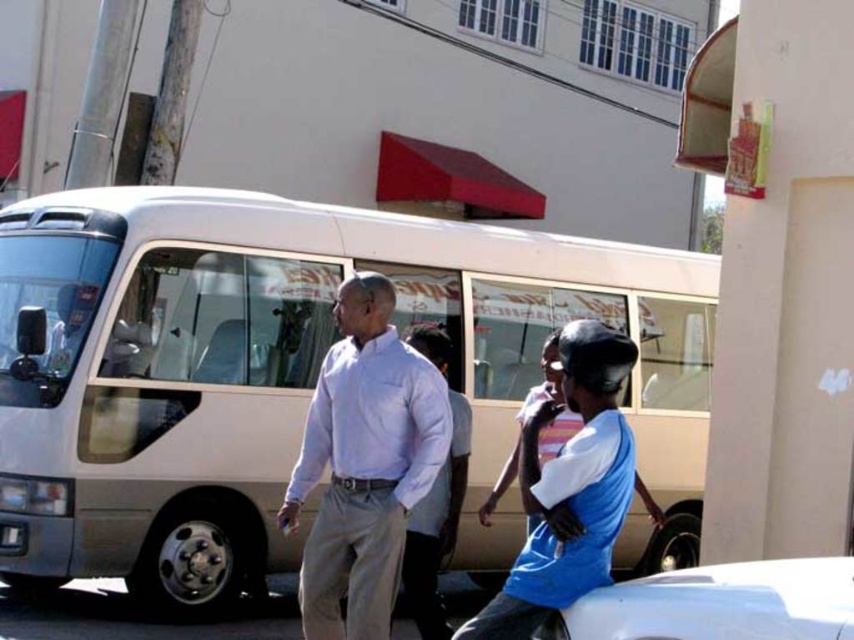
Can you confirm if beige matte bus at center is bigger than white glossy car at lower right?

Incorrect, beige matte bus at center is not larger than white glossy car at lower right.

Between beige matte bus at center and white glossy car at lower right, which one is positioned lower?

Positioned lower is white glossy car at lower right.

Does point (167, 257) lie behind point (849, 570)?

Yes, point (167, 257) is behind point (849, 570).

At what (x,y) coordinates should I click in order to perform the action: click on beige matte bus at center. Please return your answer as a coordinate pair (x, y). Looking at the image, I should click on (291, 376).

Between point (360, 536) and point (829, 573), which one is positioned in front?

Point (829, 573) is more forward.

Measure the distance from white cotton shirt at center to white glossy car at lower right.

They are 4.65 feet apart.

Locate an element on the screen. The width and height of the screenshot is (854, 640). white cotton shirt at center is located at coordinates (364, 464).

Does point (247, 321) lie behind point (577, 486)?

Yes, point (247, 321) is farther from viewer.

The height and width of the screenshot is (640, 854). Identify the location of beige matte bus at center. (291, 376).

Find the location of `beige matte bus at center`. beige matte bus at center is located at coordinates (291, 376).